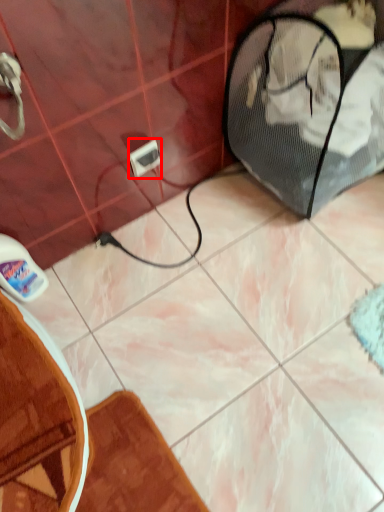
Question: Considering the relative positions of electric outlet (annotated by the red box) and bath mat in the image provided, where is electric outlet (annotated by the red box) located with respect to the staircase?

Choices:
 (A) right
 (B) left

Answer: (A)